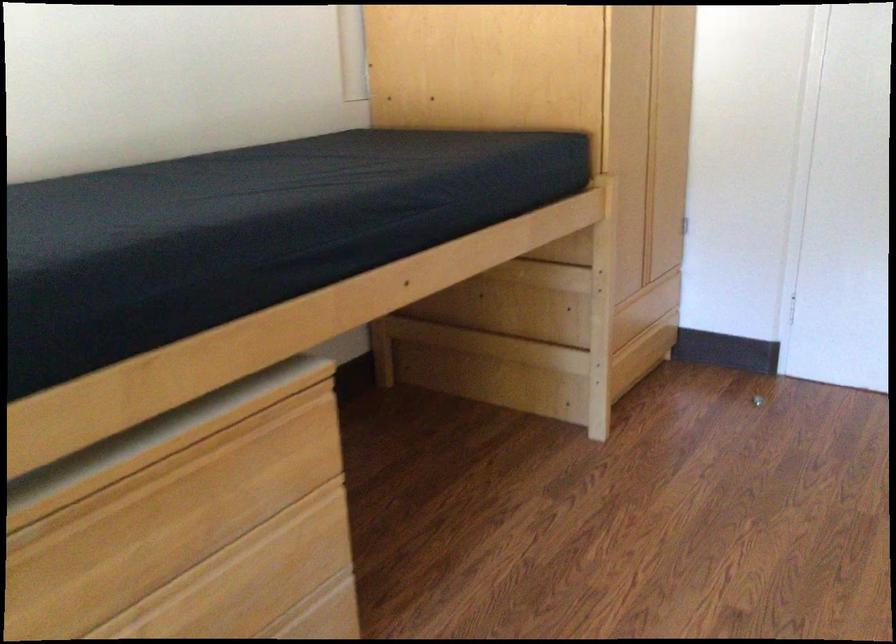
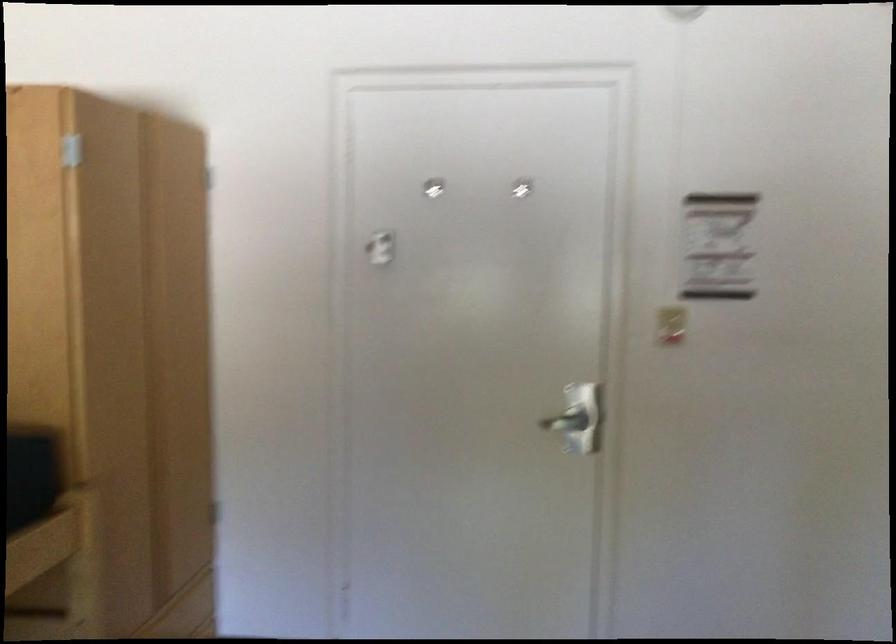
Question: The images are taken continuously from a first-person perspective. In which direction is your viewpoint rotating?

Choices:
 (A) Left
 (B) Right
 (C) Up
 (D) Down

Answer: (B)